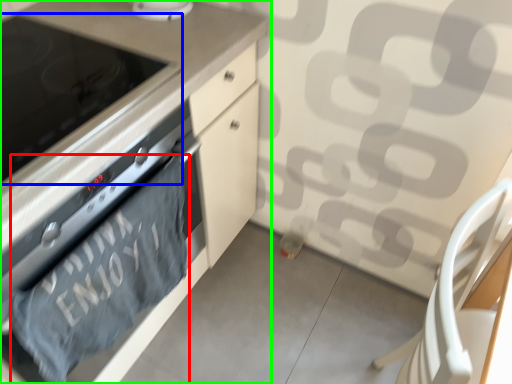
Question: Considering the real-world distances, which object is closest to bath towel (highlighted by a red box)? home appliance (highlighted by a blue box) or cabinetry (highlighted by a green box).

Choices:
 (A) home appliance
 (B) cabinetry

Answer: (B)